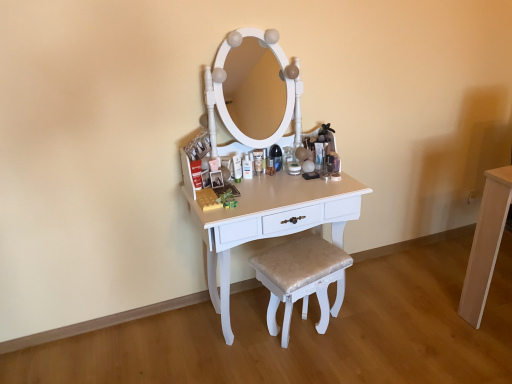
Find the location of a particular element. vacant area that lies between shiny beige cushioned stool at center and light wood cabinet at right, the 1th table when ordered from right to left is located at coordinates (406, 318).